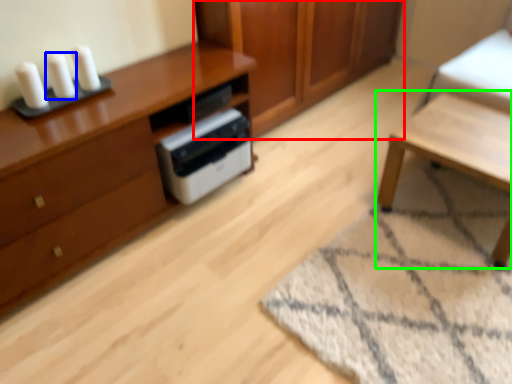
Question: Considering the real-world distances, which object is closest to cabinetry (highlighted by a red box)? candle (highlighted by a blue box) or table (highlighted by a green box).

Choices:
 (A) candle
 (B) table

Answer: (B)